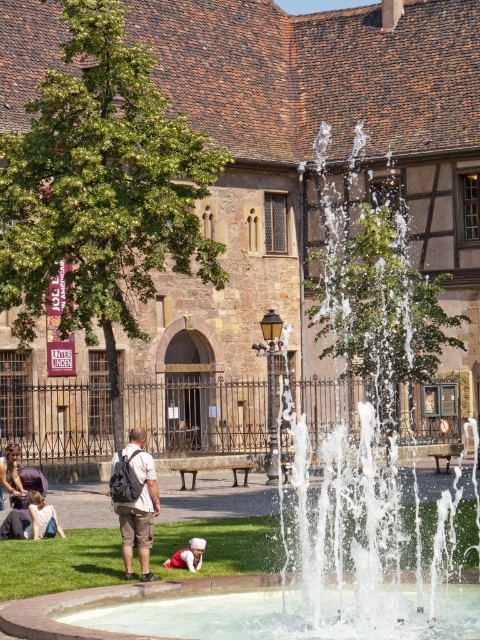
Question: Which point is farther from the camera taking this photo?

Choices:
 (A) [21, 488]
 (B) [183, 563]
 (C) [17, 513]

Answer: (A)

Question: Is matte black backpack at lower left closer to camera compared to red fabric pants at lower center?

Choices:
 (A) no
 (B) yes

Answer: (A)

Question: Which point is farther to the camera?

Choices:
 (A) matte black backpack at center
 (B) denim jacket at lower left

Answer: (B)

Question: Which point is farther to the camera?

Choices:
 (A) red fabric pants at lower center
 (B) green grass lawn at center
 (C) matte black backpack at lower left
 (D) matte black backpack at center

Answer: (C)

Question: Is green grass lawn at center closer to the viewer compared to matte black backpack at lower left?

Choices:
 (A) no
 (B) yes

Answer: (B)

Question: From the image, what is the correct spatial relationship of green grass lawn at center in relation to denim jacket at lower left?

Choices:
 (A) left
 (B) right

Answer: (B)